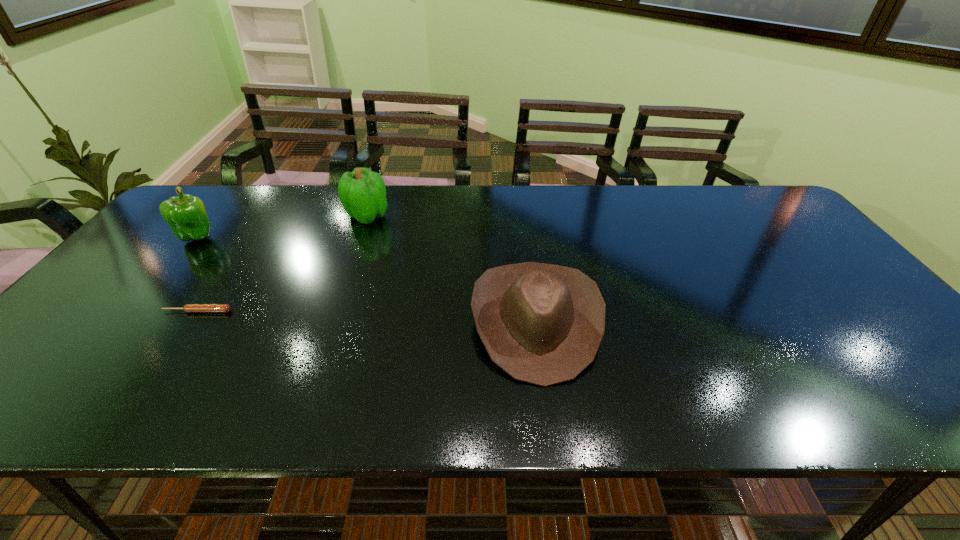
Locate an element on the screen. vacant point located between the right bell pepper and the sausage is located at coordinates (282, 264).

I want to click on empty location between the shortest object and the right bell pepper, so click(x=282, y=264).

Find the location of a particular element. This screenshot has height=540, width=960. vacant area that lies between the shortest object and the right bell pepper is located at coordinates click(282, 264).

At what (x,y) coordinates should I click in order to perform the action: click on free space between the third tallest object and the third object from left to right. Please return your answer as a coordinate pair (x, y). The width and height of the screenshot is (960, 540). Looking at the image, I should click on (451, 268).

Where is `empty space that is in between the left bell pepper and the right bell pepper`? Image resolution: width=960 pixels, height=540 pixels. empty space that is in between the left bell pepper and the right bell pepper is located at coordinates (282, 226).

Locate an element on the screen. The image size is (960, 540). blank region between the left bell pepper and the sausage is located at coordinates (198, 274).

The width and height of the screenshot is (960, 540). Identify the location of free space between the rightmost object and the shortest object. (367, 316).

At what (x,y) coordinates should I click in order to perform the action: click on vacant space that is in between the left bell pepper and the sausage. Please return your answer as a coordinate pair (x, y). Image resolution: width=960 pixels, height=540 pixels. Looking at the image, I should click on (198, 274).

Select which object is the second closest to the left bell pepper. Please provide its 2D coordinates. Your answer should be formatted as a tuple, i.e. [(x, y)], where the tuple contains the x and y coordinates of a point satisfying the conditions above.

[(362, 192)]

Where is `object that stands as the closest to the second object from left to right`? The width and height of the screenshot is (960, 540). object that stands as the closest to the second object from left to right is located at coordinates (186, 215).